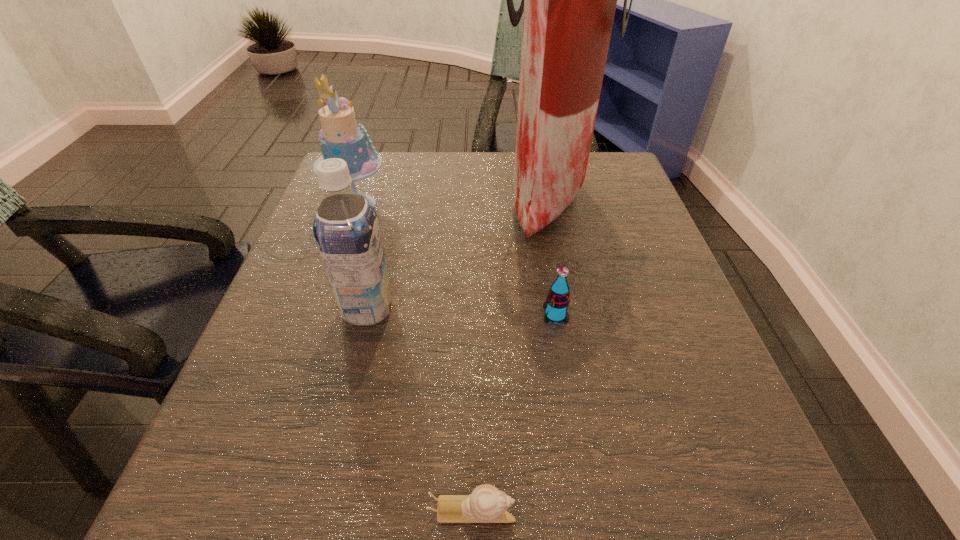
The width and height of the screenshot is (960, 540). In order to click on free region at the near edge of the desktop in this screenshot , I will do (331, 482).

Where is `free space at the left edge of the desktop`? The height and width of the screenshot is (540, 960). free space at the left edge of the desktop is located at coordinates (266, 349).

Identify the location of vacant area at the right edge of the desktop. (712, 371).

In the image, there is a desktop. Where is `blank space at the near left corner`? blank space at the near left corner is located at coordinates (310, 465).

Identify the location of vacant area at the far right corner of the desktop. (613, 198).

Find the location of a particular element. This screenshot has width=960, height=540. free spot between the tallest object and the cake is located at coordinates (452, 201).

The width and height of the screenshot is (960, 540). Find the location of `vacant space that is in between the escargot and the cake`. vacant space that is in between the escargot and the cake is located at coordinates (415, 357).

Find the location of `free space between the cake and the escargot`. free space between the cake and the escargot is located at coordinates (415, 357).

The height and width of the screenshot is (540, 960). I want to click on free space between the grocery bag and the soya milk, so click(458, 253).

This screenshot has height=540, width=960. Find the location of `free space between the soda and the soya milk`. free space between the soda and the soya milk is located at coordinates (462, 312).